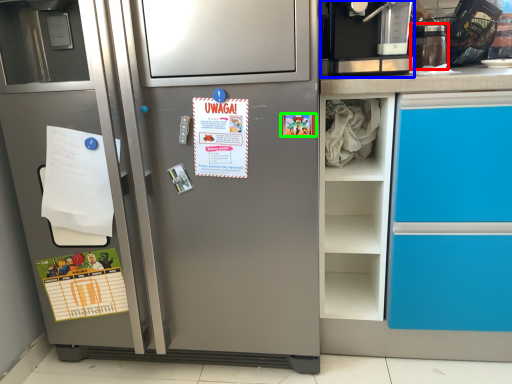
Question: Which object is positioned farthest from appliance (highlighted by a red box)? Select from coffee machine (highlighted by a blue box) and postcard (highlighted by a green box).

Choices:
 (A) coffee machine
 (B) postcard

Answer: (B)